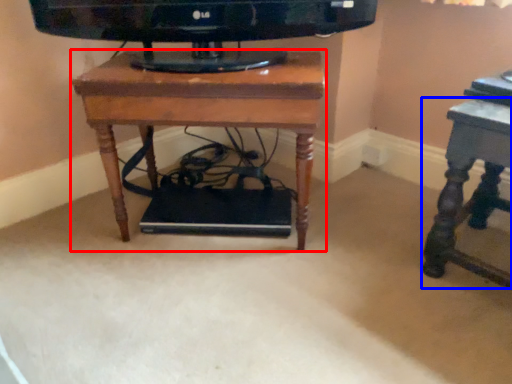
Question: Among these objects, which one is farthest to the camera, table (highlighted by a red box) or table (highlighted by a blue box)?

Choices:
 (A) table
 (B) table

Answer: (A)